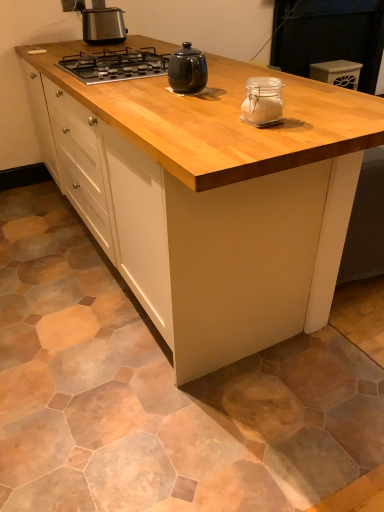
The height and width of the screenshot is (512, 384). Find the location of `free space behind clear glass jar at center, positioned as the 3th kitchen appliance in left-to-right order`. free space behind clear glass jar at center, positioned as the 3th kitchen appliance in left-to-right order is located at coordinates (242, 98).